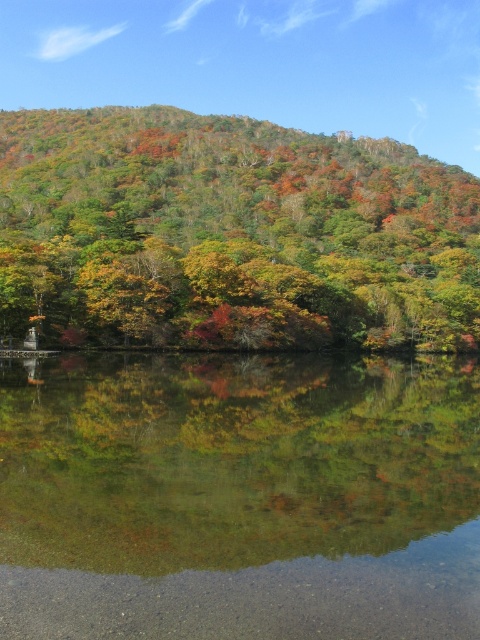
Question: Does clear glass water at center have a lesser width compared to multicolored foliage at center?

Choices:
 (A) yes
 (B) no

Answer: (A)

Question: From the image, what is the correct spatial relationship of clear glass water at center in relation to multicolored foliage at center?

Choices:
 (A) below
 (B) above

Answer: (A)

Question: Which point appears closest to the camera in this image?

Choices:
 (A) (27, 227)
 (B) (328, 456)

Answer: (B)

Question: Among these points, which one is farthest from the camera?

Choices:
 (A) (91, 378)
 (B) (222, 204)

Answer: (B)

Question: Observing the image, what is the correct spatial positioning of clear glass water at center in reference to multicolored foliage at center?

Choices:
 (A) left
 (B) right

Answer: (A)